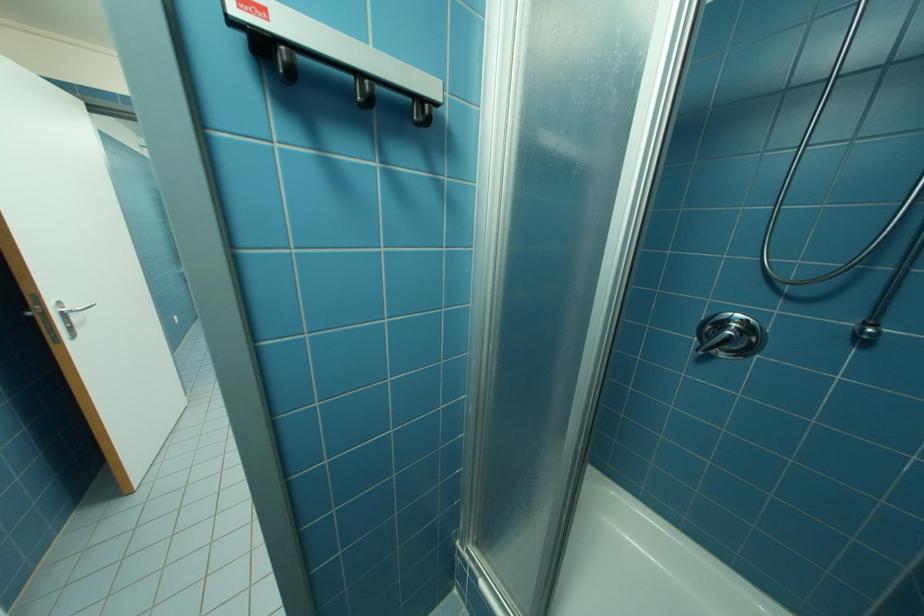
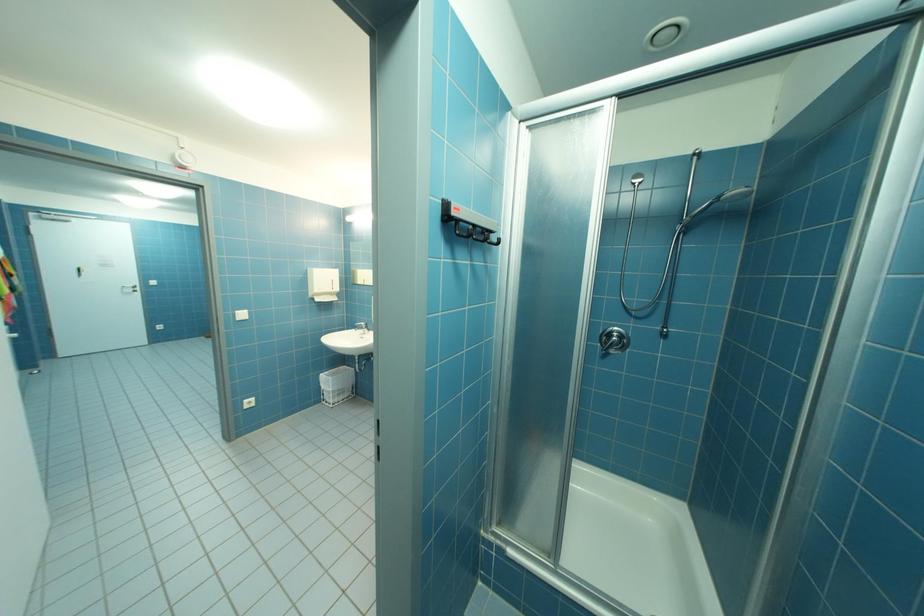
In a continuous first-person perspective shot, in which direction is the camera moving?

The movement direction of the cameraman is left, backward.